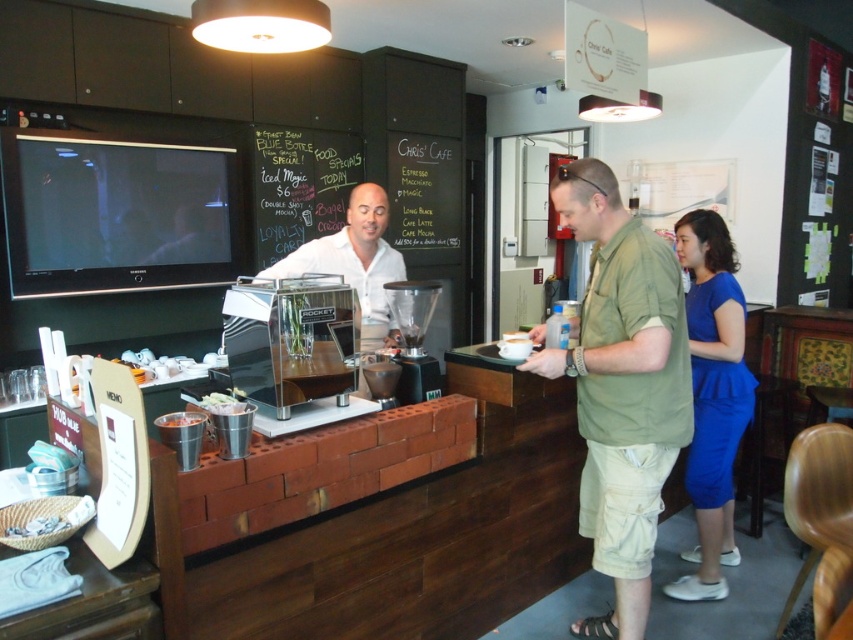
At what (x,y) coordinates should I click in order to perform the action: click on green cotton shirt at right. Please return your answer as a coordinate pair (x, y). The width and height of the screenshot is (853, 640). Looking at the image, I should click on (622, 387).

Who is higher up, green cotton shirt at right or black chalkboard at upper center?

Positioned higher is black chalkboard at upper center.

You are a GUI agent. You are given a task and a screenshot of the screen. Output one action in this format:
    pyautogui.click(x=<x>, y=<y>)
    Task: Click on the green cotton shirt at right
    This screenshot has height=640, width=853.
    Given the screenshot: What is the action you would take?
    pyautogui.click(x=622, y=387)

Locate an element on the screen. The height and width of the screenshot is (640, 853). green cotton shirt at right is located at coordinates (622, 387).

Does blue satin dress at lower right appear on the right side of black chalkboard at upper center?

Correct, you'll find blue satin dress at lower right to the right of black chalkboard at upper center.

Locate an element on the screen. blue satin dress at lower right is located at coordinates pos(712,396).

Which of these two, green cotton shirt at right or blue satin dress at lower right, stands shorter?

blue satin dress at lower right

Who is positioned more to the left, green cotton shirt at right or blue satin dress at lower right?

From the viewer's perspective, green cotton shirt at right appears more on the left side.

Locate an element on the screen. green cotton shirt at right is located at coordinates (622, 387).

At what (x,y) coordinates should I click in order to perform the action: click on green cotton shirt at right. Please return your answer as a coordinate pair (x, y). This screenshot has height=640, width=853. Looking at the image, I should click on (622, 387).